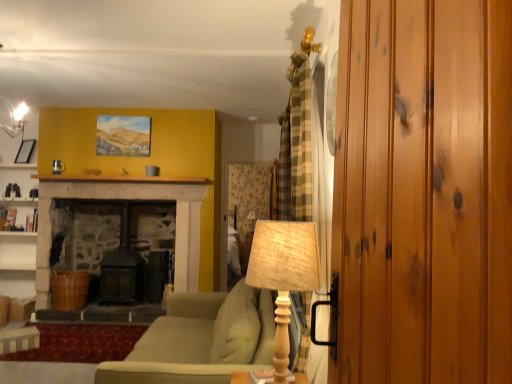
Question: In terms of size, does matte black picture frame at upper left appear bigger or smaller than matte stone fireplace at upper center?

Choices:
 (A) big
 (B) small

Answer: (B)

Question: Would you say matte black picture frame at upper left is inside or outside matte stone fireplace at upper center?

Choices:
 (A) inside
 (B) outside

Answer: (B)

Question: Which object is positioned farthest from the wooden textured table lamp at center, the first table lamp when ordered from front to back?

Choices:
 (A) burlap lampshade at center, placed as the second table lamp when sorted from front to back
 (B) glossy wood wardrobe at right
 (C) matte green fabric couch at center
 (D) matte black picture frame at upper left
 (E) matte stone fireplace at upper center

Answer: (D)

Question: Estimate the real-world distances between objects in this image. Which object is closer to the matte stone fireplace at upper center?

Choices:
 (A) burlap lampshade at center, placed as the second table lamp when sorted from front to back
 (B) matte green fabric couch at center
 (C) matte black picture frame at upper left
 (D) wooden textured table lamp at center, the first table lamp when ordered from front to back
 (E) glossy wood wardrobe at right

Answer: (C)